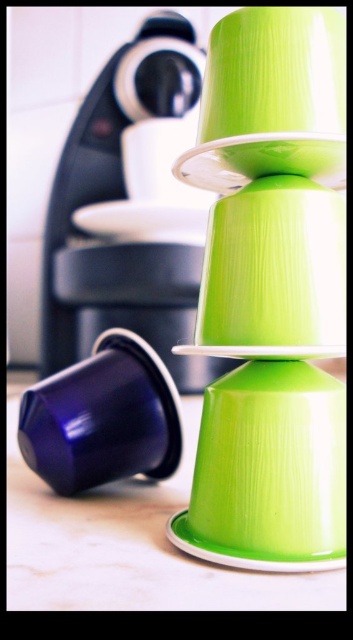
Question: Can you confirm if black plastic coffee machine at upper center is positioned to the right of matte blue cup at lower left?

Choices:
 (A) yes
 (B) no

Answer: (B)

Question: Among these objects, which one is nearest to the camera?

Choices:
 (A) green matte plate at center
 (B) green plastic cups at center

Answer: (A)

Question: Is green matte plate at center above white glossy plate at center?

Choices:
 (A) yes
 (B) no

Answer: (B)

Question: Which point is closer to the camera taking this photo?

Choices:
 (A) (247, 140)
 (B) (150, 564)

Answer: (A)

Question: Which point is farther from the camera taking this photo?

Choices:
 (A) (124, 230)
 (B) (82, 420)
 (C) (189, 48)
 (D) (24, 515)

Answer: (C)

Question: In this image, where is matte blue cup at lower left located relative to green matte plate at center?

Choices:
 (A) above
 (B) below

Answer: (B)